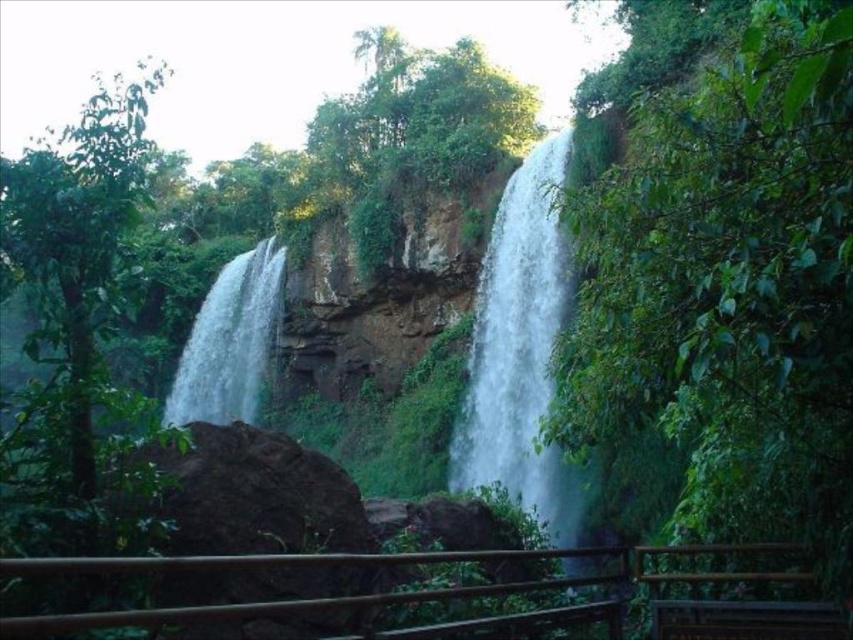
Is brown wooden rail at lower center shorter than white smooth waterfall at left?

Indeed, brown wooden rail at lower center has a lesser height compared to white smooth waterfall at left.

Which is above, brown wooden rail at lower center or white smooth waterfall at left?

white smooth waterfall at left is above.

Where is `brown wooden rail at lower center`? brown wooden rail at lower center is located at coordinates (358, 595).

This screenshot has width=853, height=640. Identify the location of brown wooden rail at lower center. (358, 595).

Measure the distance between white frothy water at center and camera.

white frothy water at center and camera are 9.43 meters apart.

Who is shorter, white frothy water at center or brown wooden rail at lower center?

With less height is brown wooden rail at lower center.

Is point (505, 214) less distant than point (416, 637)?

No, (505, 214) is further to viewer.

The width and height of the screenshot is (853, 640). Identify the location of white frothy water at center. (519, 349).

Between point (549, 513) and point (263, 353), which one is positioned in front?

Positioned in front is point (549, 513).

Is white frothy water at center above white smooth waterfall at left?

Yes.

Is point (502, 413) positioned after point (263, 349)?

No, it is in front of (263, 349).

You are a GUI agent. You are given a task and a screenshot of the screen. Output one action in this format:
    pyautogui.click(x=<x>, y=<y>)
    Task: Click on the white frothy water at center
    
    Given the screenshot: What is the action you would take?
    pyautogui.click(x=519, y=349)